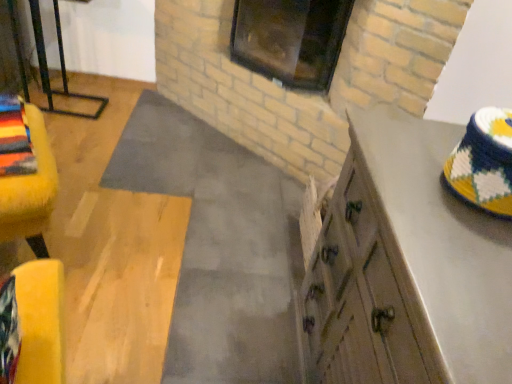
Question: Would you say yellow fuzzy ottoman at left is to the left or to the right of dark glass window at upper center in the picture?

Choices:
 (A) right
 (B) left

Answer: (B)

Question: From the image's perspective, is yellow fuzzy ottoman at left above or below dark glass window at upper center?

Choices:
 (A) above
 (B) below

Answer: (B)

Question: Estimate the real-world distances between objects in this image. Which object is farther from the dark glass window at upper center?

Choices:
 (A) yellow fuzzy ottoman at left
 (B) wooden cabinet at right

Answer: (A)

Question: Considering the real-world distances, which object is farthest from the yellow fuzzy ottoman at left?

Choices:
 (A) wooden cabinet at right
 (B) dark glass window at upper center

Answer: (B)